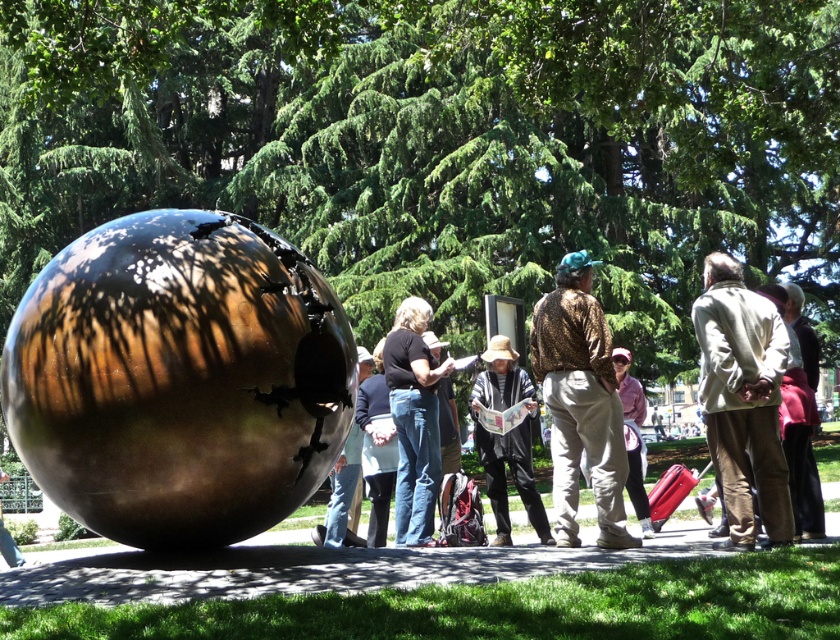
Does striped sweater at center have a lesser width compared to matte black shirt at center?

Incorrect, striped sweater at center's width is not less than matte black shirt at center's.

Between point (501, 406) and point (339, 525), which one is positioned behind?

The point (501, 406) is more distant.

Is point (504, 406) less distant than point (348, 506)?

That is False.

Where is `striped sweater at center`? striped sweater at center is located at coordinates (507, 440).

Does black matte shirt at center appear over striped sweater at center?

Indeed, black matte shirt at center is positioned over striped sweater at center.

From the picture: Can you confirm if black matte shirt at center is bigger than striped sweater at center?

Actually, black matte shirt at center might be smaller than striped sweater at center.

Is point (396, 413) farther from camera compared to point (526, 440)?

No.

Identify the location of black matte shirt at center. (413, 420).

Is light beige jacket at right thinner than black matte shirt at center?

In fact, light beige jacket at right might be wider than black matte shirt at center.

Which of these two, light beige jacket at right or black matte shirt at center, stands taller?

light beige jacket at right is taller.

Which is behind, point (697, 304) or point (395, 381)?

The point (395, 381) is behind.

You are a GUI agent. You are given a task and a screenshot of the screen. Output one action in this format:
    pyautogui.click(x=<x>, y=<y>)
    Task: Click on the light beige jacket at right
    This screenshot has height=640, width=840.
    Given the screenshot: What is the action you would take?
    pyautogui.click(x=743, y=401)